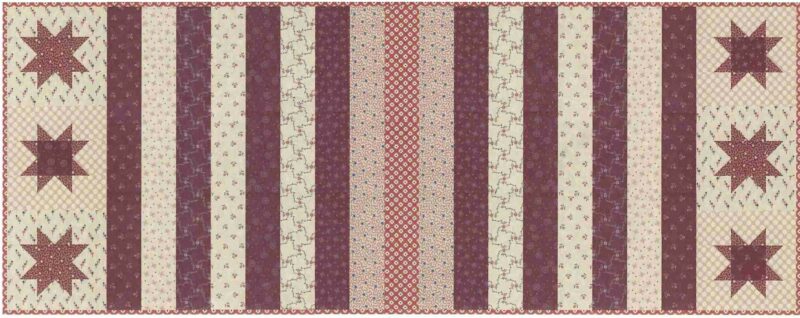
What are the coordinates of `tapestry` in the screenshot? It's located at (416, 110).